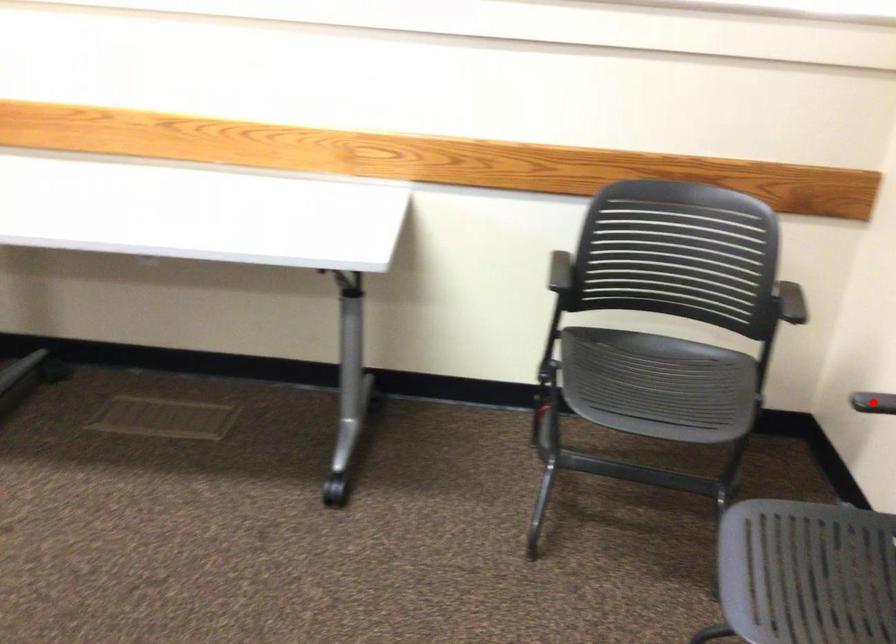
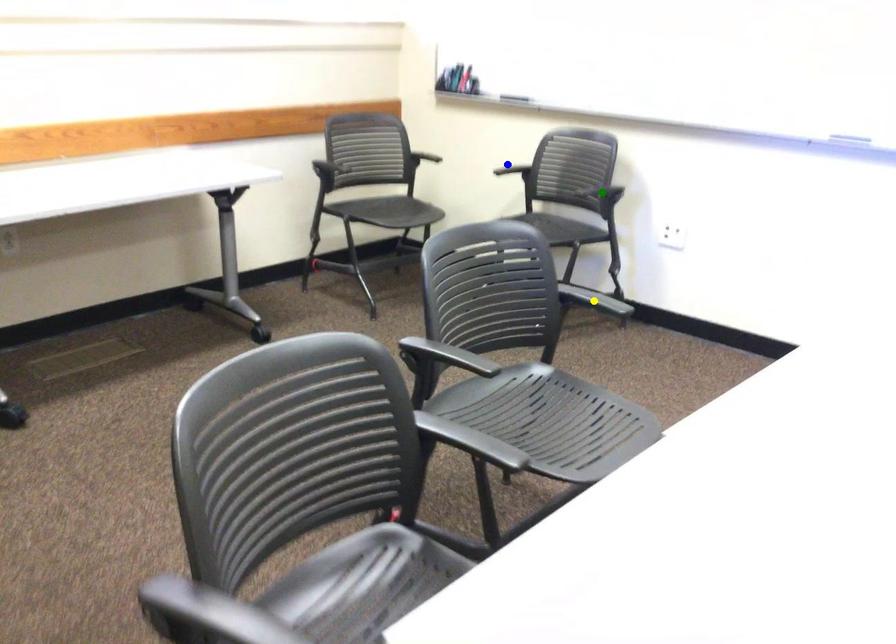
Question: I am providing you with two images of the same scene from different viewpoints. A red point is marked on the first image. You are given multiple points on the second image. Which mark in image 2 goes with the point in image 1?

Choices:
 (A) yellow point
 (B) green point
 (C) blue point

Answer: (C)